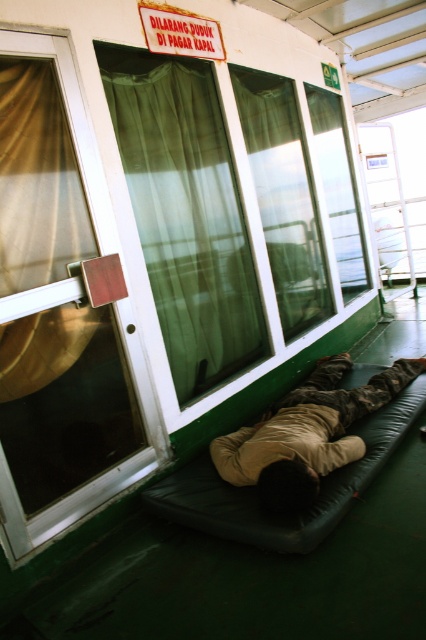
Based on the scene description, where is the green sheer curtain at upper center located in the image?

The green sheer curtain at upper center is located at point (186, 212).

You are planning to hang a new curtain in the ferry cabin. The existing green sheer curtain at upper center and the translucent fabric curtain at left are already present. Which curtain has a greater width to match your new curtain design?

The green sheer curtain at upper center has a greater width than the translucent fabric curtain at left, so it would be the better match for your new curtain design.